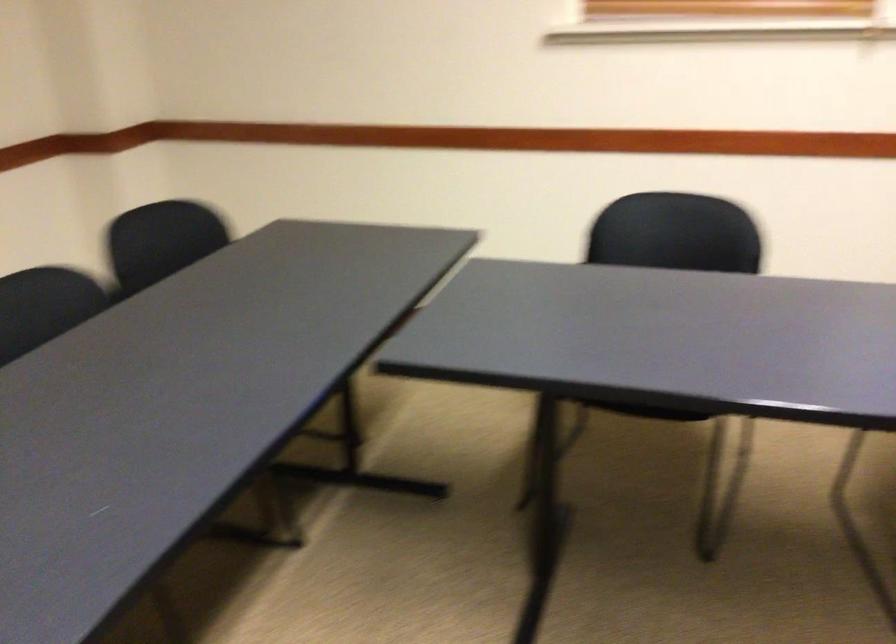
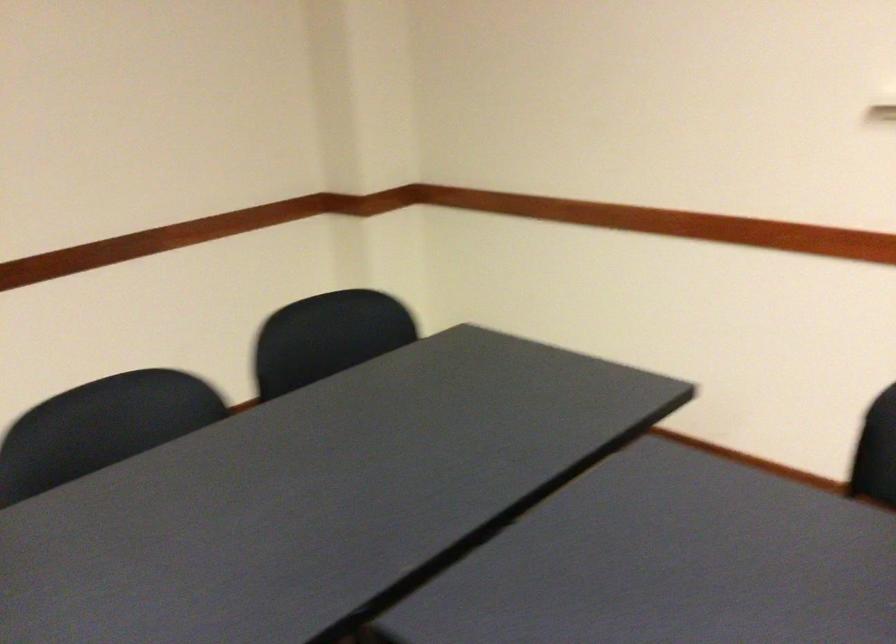
What movement of the cameraman would produce the second image?

The movement direction of the cameraman is right, forward.